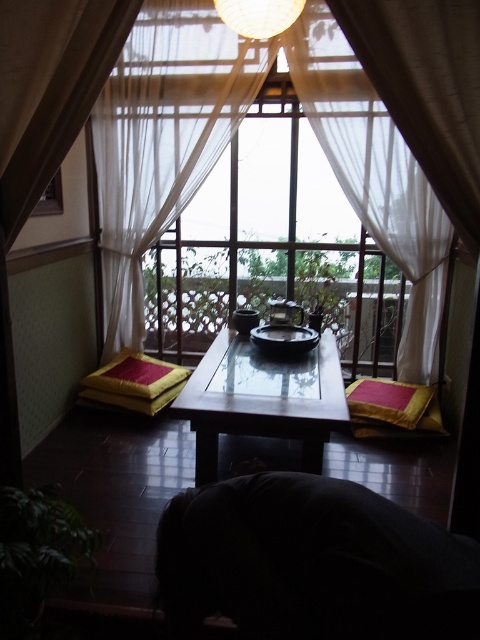
Question: Is transparent glass table at center closer to the viewer compared to yellow fabric cushion at lower left?

Choices:
 (A) no
 (B) yes

Answer: (B)

Question: Which of the following is the farthest from the observer?

Choices:
 (A) white sheer curtain at center
 (B) yellow fabric cushion at lower left
 (C) transparent glass table at center

Answer: (B)

Question: Is transparent glass table at center above yellow fabric cushion at lower left?

Choices:
 (A) no
 (B) yes

Answer: (A)

Question: Is white sheer curtain at center to the right of transparent glass table at center from the viewer's perspective?

Choices:
 (A) yes
 (B) no

Answer: (B)

Question: Which of the following is the farthest from the observer?

Choices:
 (A) (87, 380)
 (B) (410, 426)
 (C) (155, 83)
 (D) (263, 371)

Answer: (A)

Question: Estimate the real-world distances between objects in this image. Which object is closer to the transparent glass table at center?

Choices:
 (A) white sheer curtain at center
 (B) velvet-like red cushion at lower right

Answer: (B)